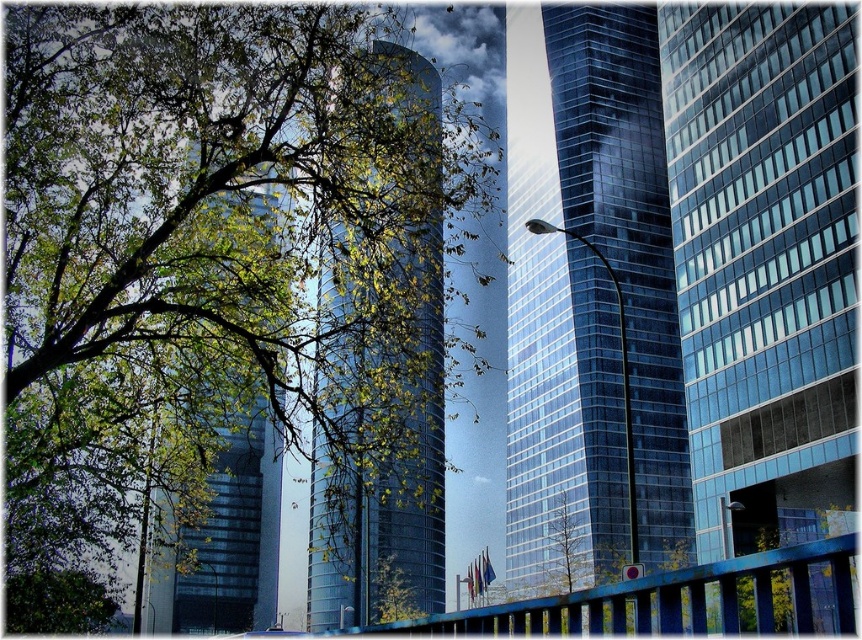
Question: Where is glossy glass tower at center located in relation to green leafy tree at upper left in the image?

Choices:
 (A) below
 (B) above

Answer: (A)

Question: Can you confirm if shiny glass skyscraper at center is positioned to the right of green leafy tree at upper left?

Choices:
 (A) no
 (B) yes

Answer: (B)

Question: Which point is closer to the camera?

Choices:
 (A) green leafy tree at upper left
 (B) transparent glass skyscraper at center
 (C) shiny glass skyscraper at center

Answer: (B)

Question: Does glossy glass tower at center appear on the right side of green leafy tree at upper left?

Choices:
 (A) yes
 (B) no

Answer: (B)

Question: Which point is closer to the camera taking this photo?

Choices:
 (A) (404, 458)
 (B) (498, 92)

Answer: (A)

Question: Which object is the farthest from the glossy glass tower at center?

Choices:
 (A) transparent glass skyscraper at center
 (B) green leafy tree at upper left
 (C) shiny glass skyscraper at center

Answer: (C)